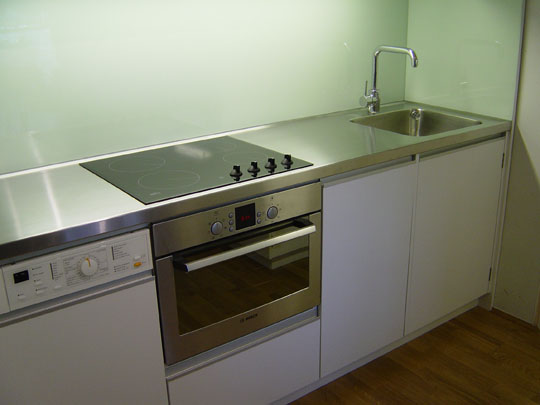
Locate an element on the screen. The height and width of the screenshot is (405, 540). wall is located at coordinates (194, 70).